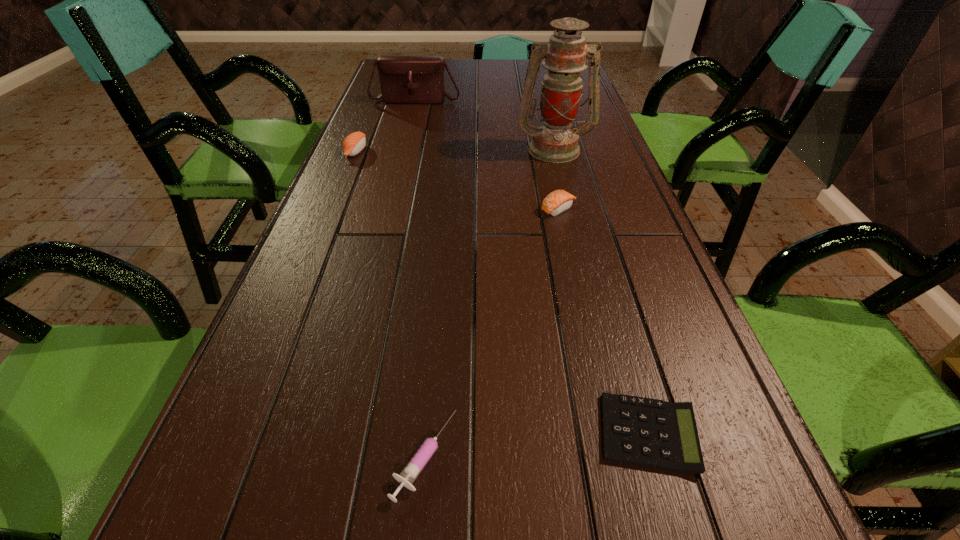
Find the location of a particular element. free location located on the front flap of the farthest object is located at coordinates (407, 131).

Where is `free space located 0.150m on the front of the fourth shortest object`? The height and width of the screenshot is (540, 960). free space located 0.150m on the front of the fourth shortest object is located at coordinates (339, 192).

This screenshot has height=540, width=960. Identify the location of vacant region located on the back of the nearer sushi. (543, 141).

You are a GUI agent. You are given a task and a screenshot of the screen. Output one action in this format:
    pyautogui.click(x=<x>, y=<y>)
    Task: Click on the free space located 0.320m on the right of the fifth tallest object
    The width and height of the screenshot is (960, 540).
    Given the screenshot: What is the action you would take?
    pyautogui.click(x=686, y=456)

This screenshot has height=540, width=960. I want to click on vacant space located on the left of the shortest object, so click(x=549, y=433).

This screenshot has height=540, width=960. Find the location of `shoulder bag present at the left edge`. shoulder bag present at the left edge is located at coordinates (404, 79).

The image size is (960, 540). Find the location of `sushi at the left edge`. sushi at the left edge is located at coordinates (354, 143).

Locate an element on the screen. The width and height of the screenshot is (960, 540). oil lamp that is at the right edge is located at coordinates (555, 142).

In order to click on sushi present at the right edge in this screenshot , I will do `click(558, 201)`.

Identify the location of calculator located at the right edge. (645, 432).